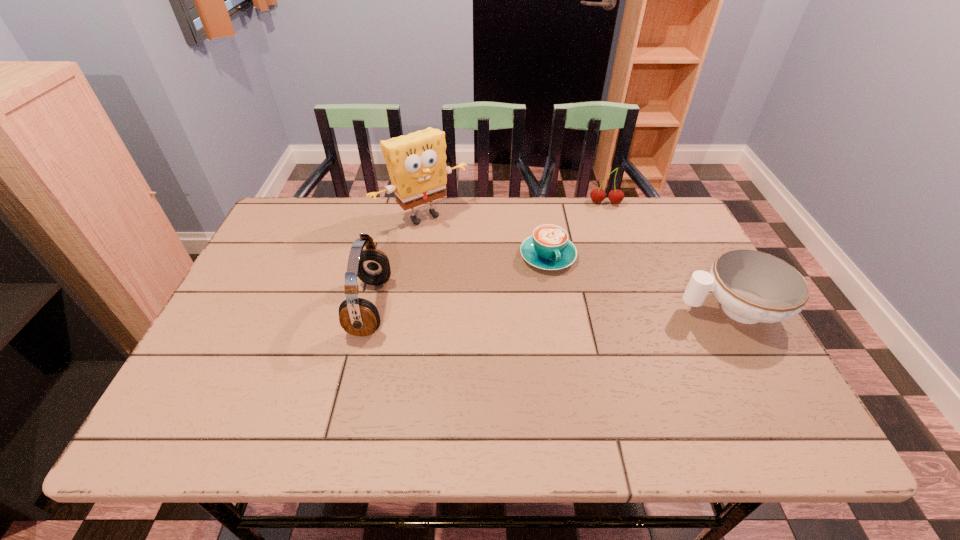
The height and width of the screenshot is (540, 960). In order to click on free space located 0.160m on the side with the handle of the chinaware in this screenshot , I will do pyautogui.click(x=614, y=309).

Locate an element on the screen. Image resolution: width=960 pixels, height=540 pixels. free point located on the face of the tallest object is located at coordinates (489, 277).

In order to click on free point located on the face of the tallest object in this screenshot , I will do `click(527, 317)`.

Identify the location of free region located 0.050m on the face of the tallest object. (454, 241).

Locate an element on the screen. free space located with the handle on the right side of the shortest object is located at coordinates (591, 348).

At what (x,y) coordinates should I click in order to perform the action: click on free region located with the handle on the right side of the shortest object. Please return your answer as a coordinate pair (x, y). Looking at the image, I should click on (588, 342).

Identify the location of free region located with the handle on the right side of the shortest object. This screenshot has width=960, height=540. (572, 307).

You are a GUI agent. You are given a task and a screenshot of the screen. Output one action in this format:
    pyautogui.click(x=<x>, y=<y>)
    Task: Click on the free space located 0.330m on the surface of the cherry
    
    Given the screenshot: What is the action you would take?
    pyautogui.click(x=603, y=278)

Identify the location of free space located 0.380m on the surface of the cherry. The image size is (960, 540). [603, 291].

In order to click on free space located on the surface of the cherry in this screenshot , I will do `click(603, 249)`.